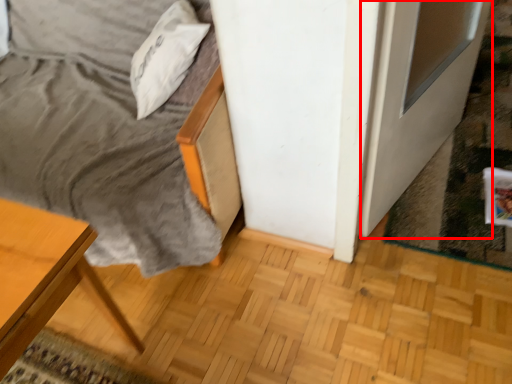
Question: From the image's perspective, what is the correct spatial positioning of screen door (annotated by the red box) in reference to pillow?

Choices:
 (A) below
 (B) above

Answer: (A)